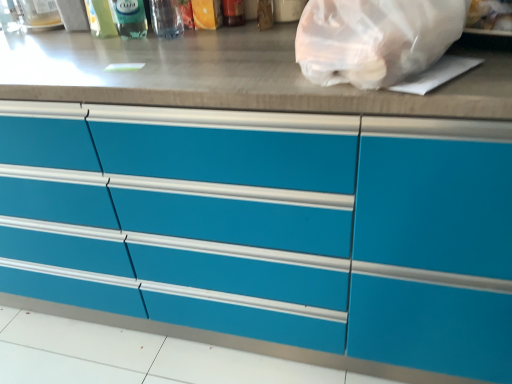
Based on the photo, how much space does transparent plastic bottle at upper center, placed as the third bottle when sorted from left to right, occupy horizontally?

transparent plastic bottle at upper center, placed as the third bottle when sorted from left to right, is 4.29 inches wide.

How much space does translucent plastic bottle at upper center, which appears as the third bottle when viewed from the right, occupy horizontally?

It is 2.91 inches.

The width and height of the screenshot is (512, 384). What do you see at coordinates (269, 226) in the screenshot?
I see `matte blue drawers at center` at bounding box center [269, 226].

Where is `transparent plastic bottle at upper center, marked as the 1th bottle in a right-to-left arrangement`? The height and width of the screenshot is (384, 512). transparent plastic bottle at upper center, marked as the 1th bottle in a right-to-left arrangement is located at coordinates (166, 18).

Image resolution: width=512 pixels, height=384 pixels. In order to click on bottle below the transparent plastic bottle at upper left, which is the 2th bottle in left-to-right order (from the image's perspective) in this screenshot , I will do `click(166, 18)`.

How far apart are transparent plastic bottle at upper center, marked as the 1th bottle in a right-to-left arrangement, and transparent plastic bottle at upper left, which is the second bottle in right-to-left order?

A distance of 2.58 inches exists between transparent plastic bottle at upper center, marked as the 1th bottle in a right-to-left arrangement, and transparent plastic bottle at upper left, which is the second bottle in right-to-left order.

Considering the sizes of objects transparent plastic bottle at upper center, marked as the 1th bottle in a right-to-left arrangement, and transparent plastic bottle at upper left, which is the 2th bottle in left-to-right order, in the image provided, who is thinner, transparent plastic bottle at upper center, marked as the 1th bottle in a right-to-left arrangement, or transparent plastic bottle at upper left, which is the 2th bottle in left-to-right order,?

transparent plastic bottle at upper left, which is the 2th bottle in left-to-right order, is thinner.

Which object is more forward, transparent plastic bottle at upper center, marked as the 1th bottle in a right-to-left arrangement, or transparent plastic bottle at upper left, which is the second bottle in right-to-left order?

Positioned in front is transparent plastic bottle at upper center, marked as the 1th bottle in a right-to-left arrangement.

How distant is translucent plastic bottle at upper center, which is the first bottle from left to right, from transparent plastic bottle at upper center, marked as the 1th bottle in a right-to-left arrangement?

translucent plastic bottle at upper center, which is the first bottle from left to right, is 7.06 inches from transparent plastic bottle at upper center, marked as the 1th bottle in a right-to-left arrangement.

From a real-world perspective, is translucent plastic bottle at upper center, which appears as the third bottle when viewed from the right, positioned under transparent plastic bottle at upper center, marked as the 1th bottle in a right-to-left arrangement, based on gravity?

Correct, in the physical world, translucent plastic bottle at upper center, which appears as the third bottle when viewed from the right, is lower than transparent plastic bottle at upper center, marked as the 1th bottle in a right-to-left arrangement.

Are translucent plastic bottle at upper center, which appears as the third bottle when viewed from the right, and transparent plastic bottle at upper center, marked as the 1th bottle in a right-to-left arrangement, making contact?

No, translucent plastic bottle at upper center, which appears as the third bottle when viewed from the right, is not next to transparent plastic bottle at upper center, marked as the 1th bottle in a right-to-left arrangement.

Looking at this image, can you confirm if translucent plastic bottle at upper center, which appears as the third bottle when viewed from the right, is bigger than transparent plastic bottle at upper center, placed as the third bottle when sorted from left to right?

No.

Is transparent plastic bottle at upper left, which is the second bottle in right-to-left order, inside the boundaries of translucent plastic bottle at upper center, which appears as the third bottle when viewed from the right, or outside?

transparent plastic bottle at upper left, which is the second bottle in right-to-left order, exists outside the volume of translucent plastic bottle at upper center, which appears as the third bottle when viewed from the right.

From a real-world perspective, is transparent plastic bottle at upper left, which is the second bottle in right-to-left order, located higher than translucent plastic bottle at upper center, which appears as the third bottle when viewed from the right?

No, from a real-world perspective, transparent plastic bottle at upper left, which is the second bottle in right-to-left order, is not over translucent plastic bottle at upper center, which appears as the third bottle when viewed from the right

Does transparent plastic bottle at upper left, which is the 2th bottle in left-to-right order, have a lesser width compared to translucent plastic bottle at upper center, which appears as the third bottle when viewed from the right?

Incorrect, the width of transparent plastic bottle at upper left, which is the 2th bottle in left-to-right order, is not less than that of translucent plastic bottle at upper center, which appears as the third bottle when viewed from the right.

Considering the relative positions of transparent plastic bottle at upper center, placed as the third bottle when sorted from left to right, and translucent plastic bottle at upper center, which appears as the third bottle when viewed from the right, in the image provided, is transparent plastic bottle at upper center, placed as the third bottle when sorted from left to right, to the left of translucent plastic bottle at upper center, which appears as the third bottle when viewed from the right, from the viewer's perspective?

No.

Based on the photo, which object is wider, transparent plastic bottle at upper center, marked as the 1th bottle in a right-to-left arrangement, or translucent plastic bottle at upper center, which appears as the third bottle when viewed from the right?

transparent plastic bottle at upper center, marked as the 1th bottle in a right-to-left arrangement, is wider.

Looking at this image, from a real-world perspective, is transparent plastic bottle at upper center, marked as the 1th bottle in a right-to-left arrangement, above or below translucent plastic bottle at upper center, which is the first bottle from left to right?

From a real-world perspective, transparent plastic bottle at upper center, marked as the 1th bottle in a right-to-left arrangement, is physically above translucent plastic bottle at upper center, which is the first bottle from left to right.

Is transparent plastic bottle at upper center, placed as the third bottle when sorted from left to right, not within translucent plastic bottle at upper center, which is the first bottle from left to right?

transparent plastic bottle at upper center, placed as the third bottle when sorted from left to right, is positioned outside translucent plastic bottle at upper center, which is the first bottle from left to right.

Considering the relative sizes of transparent plastic bottle at upper center, marked as the 1th bottle in a right-to-left arrangement, and matte blue drawers at center in the image provided, is transparent plastic bottle at upper center, marked as the 1th bottle in a right-to-left arrangement, bigger than matte blue drawers at center?

Incorrect, transparent plastic bottle at upper center, marked as the 1th bottle in a right-to-left arrangement, is not larger than matte blue drawers at center.

From the image's perspective, which is above, transparent plastic bottle at upper center, marked as the 1th bottle in a right-to-left arrangement, or matte blue drawers at center?

transparent plastic bottle at upper center, marked as the 1th bottle in a right-to-left arrangement, appears higher in the image.

Between transparent plastic bottle at upper left, which is the 2th bottle in left-to-right order, and transparent plastic bag at upper right, which one has larger width?

transparent plastic bag at upper right.

Can you tell me how much transparent plastic bottle at upper left, which is the second bottle in right-to-left order, and transparent plastic bag at upper right differ in facing direction?

transparent plastic bottle at upper left, which is the second bottle in right-to-left order, and transparent plastic bag at upper right are facing 0.785 degrees away from each other.

At what (x,y) coordinates should I click in order to perform the action: click on the 2nd bottle above the transparent plastic bag at upper right (from the image's perspective). Please return your answer as a coordinate pair (x, y). This screenshot has width=512, height=384. Looking at the image, I should click on (129, 18).

Is transparent plastic bag at upper right surrounded by transparent plastic bottle at upper left, which is the second bottle in right-to-left order?

No, transparent plastic bag at upper right is not a part of transparent plastic bottle at upper left, which is the second bottle in right-to-left order.

How much distance is there between transparent plastic bottle at upper left, which is the 2th bottle in left-to-right order, and transparent plastic bottle at upper center, marked as the 1th bottle in a right-to-left arrangement?

They are 2.58 inches apart.

From the image's perspective, is transparent plastic bottle at upper left, which is the second bottle in right-to-left order, above transparent plastic bottle at upper center, placed as the third bottle when sorted from left to right?

Correct, transparent plastic bottle at upper left, which is the second bottle in right-to-left order, appears higher than transparent plastic bottle at upper center, placed as the third bottle when sorted from left to right, in the image.

Do you think transparent plastic bottle at upper left, which is the 2th bottle in left-to-right order, is within transparent plastic bottle at upper center, placed as the third bottle when sorted from left to right, or outside of it?

transparent plastic bottle at upper left, which is the 2th bottle in left-to-right order, is located beyond the bounds of transparent plastic bottle at upper center, placed as the third bottle when sorted from left to right.

From a real-world perspective, is transparent plastic bottle at upper left, which is the 2th bottle in left-to-right order, physically below transparent plastic bottle at upper center, placed as the third bottle when sorted from left to right?

Yes, from a real-world perspective, transparent plastic bottle at upper left, which is the 2th bottle in left-to-right order, is under transparent plastic bottle at upper center, placed as the third bottle when sorted from left to right.

Where is `bottle below the transparent plastic bottle at upper left, which is the second bottle in right-to-left order (from the image's perspective)`? bottle below the transparent plastic bottle at upper left, which is the second bottle in right-to-left order (from the image's perspective) is located at coordinates (166, 18).

From a real-world perspective, count 1st bottles downward from the transparent plastic bottle at upper center, marked as the 1th bottle in a right-to-left arrangement, and point to it. Please provide its 2D coordinates.

[(100, 18)]

From the image, which object appears to be farther from transparent plastic bottle at upper center, marked as the 1th bottle in a right-to-left arrangement, transparent plastic bag at upper right or transparent plastic bottle at upper left, which is the 2th bottle in left-to-right order?

Among the two, transparent plastic bag at upper right is located further to transparent plastic bottle at upper center, marked as the 1th bottle in a right-to-left arrangement.

Based on their spatial positions, is translucent plastic bottle at upper center, which appears as the third bottle when viewed from the right, or transparent plastic bottle at upper left, which is the 2th bottle in left-to-right order, further from matte blue drawers at center?

translucent plastic bottle at upper center, which appears as the third bottle when viewed from the right, is further to matte blue drawers at center.

When comparing their distances from transparent plastic bottle at upper left, which is the 2th bottle in left-to-right order, does transparent plastic bag at upper right or matte blue drawers at center seem closer?

transparent plastic bag at upper right lies closer to transparent plastic bottle at upper left, which is the 2th bottle in left-to-right order, than the other object.

Which object lies further to the anchor point transparent plastic bag at upper right, translucent plastic bottle at upper center, which appears as the third bottle when viewed from the right, or matte blue drawers at center?

translucent plastic bottle at upper center, which appears as the third bottle when viewed from the right.

Which object lies further to the anchor point matte blue drawers at center, transparent plastic bottle at upper left, which is the 2th bottle in left-to-right order, or transparent plastic bag at upper right?

Based on the image, transparent plastic bottle at upper left, which is the 2th bottle in left-to-right order, appears to be further to matte blue drawers at center.

Which object lies further to the anchor point translucent plastic bottle at upper center, which appears as the third bottle when viewed from the right, transparent plastic bottle at upper center, placed as the third bottle when sorted from left to right, or matte blue drawers at center?

matte blue drawers at center is further to translucent plastic bottle at upper center, which appears as the third bottle when viewed from the right.

Looking at the image, which one is located closer to matte blue drawers at center, transparent plastic bottle at upper left, which is the 2th bottle in left-to-right order, or transparent plastic bottle at upper center, marked as the 1th bottle in a right-to-left arrangement?

The object closer to matte blue drawers at center is transparent plastic bottle at upper center, marked as the 1th bottle in a right-to-left arrangement.

Which object lies further to the anchor point transparent plastic bottle at upper left, which is the 2th bottle in left-to-right order, translucent plastic bottle at upper center, which appears as the third bottle when viewed from the right, or transparent plastic bag at upper right?

The object further to transparent plastic bottle at upper left, which is the 2th bottle in left-to-right order, is transparent plastic bag at upper right.

Identify the location of bottle between matte blue drawers at center and transparent plastic bag at upper right. This screenshot has height=384, width=512. (166, 18).

I want to click on bottle that lies between transparent plastic bottle at upper left, which is the 2th bottle in left-to-right order, and matte blue drawers at center from top to bottom, so click(x=166, y=18).

Find the location of a particular element. The width and height of the screenshot is (512, 384). bottle located between transparent plastic bottle at upper left, which is the 2th bottle in left-to-right order, and transparent plastic bag at upper right in the left-right direction is located at coordinates (166, 18).

Where is `bottle situated between translucent plastic bottle at upper center, which is the first bottle from left to right, and transparent plastic bottle at upper center, placed as the third bottle when sorted from left to right, from left to right`? This screenshot has width=512, height=384. bottle situated between translucent plastic bottle at upper center, which is the first bottle from left to right, and transparent plastic bottle at upper center, placed as the third bottle when sorted from left to right, from left to right is located at coordinates click(129, 18).